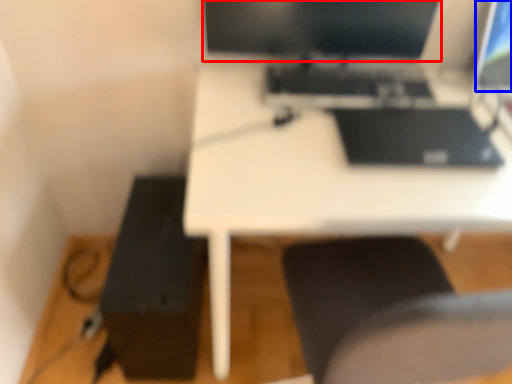
Question: Which object is closer to the camera taking this photo, computer monitor (highlighted by a red box) or computer screen (highlighted by a blue box)?

Choices:
 (A) computer monitor
 (B) computer screen

Answer: (A)